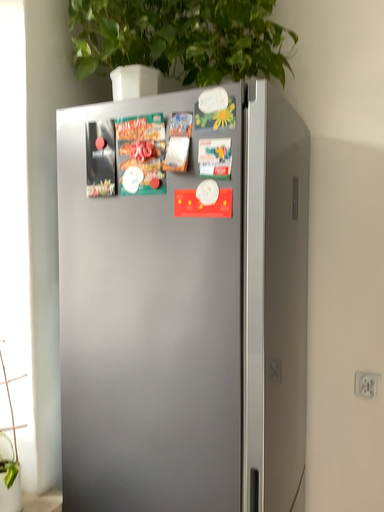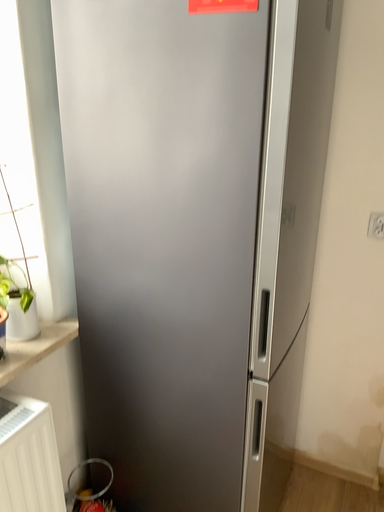
Question: How did the camera likely rotate when shooting the video?

Choices:
 (A) rotated downward
 (B) rotated upward

Answer: (A)